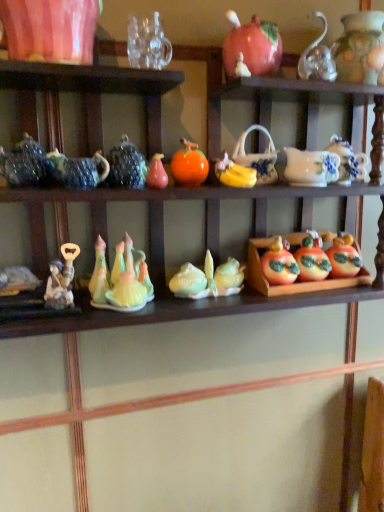
Question: From a real-world perspective, is transparent glass teapot at upper right, acting as the first tableware starting from the right, under matte ceramic corn at center, positioned as the second toy in front-to-back order?

Choices:
 (A) yes
 (B) no

Answer: (B)

Question: Can you confirm if transparent glass teapot at upper right, acting as the first tableware starting from the right, is bigger than matte ceramic corn at center, the 3th toy in the top-to-bottom sequence?

Choices:
 (A) yes
 (B) no

Answer: (B)

Question: From a real-world perspective, is transparent glass teapot at upper right, the fifth tableware from the left, on top of matte ceramic corn at center, which is the 2th toy in left-to-right order?

Choices:
 (A) yes
 (B) no

Answer: (A)

Question: Does transparent glass teapot at upper right, the fifth tableware from the left, lie in front of matte ceramic corn at center, which is the 2th toy in left-to-right order?

Choices:
 (A) no
 (B) yes

Answer: (B)

Question: Is transparent glass teapot at upper right, the fifth tableware from the left, at the right side of matte ceramic corn at center, which is the 2th toy in left-to-right order?

Choices:
 (A) yes
 (B) no

Answer: (A)

Question: From a real-world perspective, is shiny ceramic apple at center right, which is the 2th fruit from left to right, physically located above or below matte ceramic apples at center right?

Choices:
 (A) above
 (B) below

Answer: (A)

Question: From the image's perspective, is shiny ceramic apple at center right, which is the 2th fruit from left to right, positioned above or below matte ceramic apples at center right?

Choices:
 (A) below
 (B) above

Answer: (B)

Question: In terms of width, does shiny ceramic apple at center right, which is the second fruit in front-to-back order, look wider or thinner when compared to matte ceramic apples at center right?

Choices:
 (A) wide
 (B) thin

Answer: (B)

Question: Is point (299, 268) closer or farther from the camera than point (364, 279)?

Choices:
 (A) farther
 (B) closer

Answer: (B)

Question: In the image, is black glossy teapot at upper center, arranged as the second tableware when viewed from the left, on the left side or the right side of matte ceramic pumpkin at upper center, the first pumpkin in the left-to-right sequence?

Choices:
 (A) right
 (B) left

Answer: (B)

Question: Which is correct: black glossy teapot at upper center, arranged as the second tableware when viewed from the left, is inside matte ceramic pumpkin at upper center, marked as the 2th pumpkin in a right-to-left arrangement, or outside of it?

Choices:
 (A) outside
 (B) inside

Answer: (A)

Question: Is black glossy teapot at upper center, arranged as the fourth tableware when viewed from the right, in front of or behind matte ceramic pumpkin at upper center, which ranks as the 1th pumpkin in top-to-bottom order, in the image?

Choices:
 (A) behind
 (B) front

Answer: (B)

Question: In terms of height, does black glossy teapot at upper center, arranged as the fourth tableware when viewed from the right, look taller or shorter compared to matte ceramic pumpkin at upper center, placed as the second pumpkin when sorted from bottom to top?

Choices:
 (A) tall
 (B) short

Answer: (B)

Question: Considering the positions of point (137, 178) and point (29, 1), is point (137, 178) closer or farther from the camera than point (29, 1)?

Choices:
 (A) farther
 (B) closer

Answer: (A)

Question: In the image, is black glossy teapot at upper center, arranged as the second tableware when viewed from the left, positioned in front of or behind matte pink vase at upper left, which is the fifth tableware in right-to-left order?

Choices:
 (A) behind
 (B) front

Answer: (A)